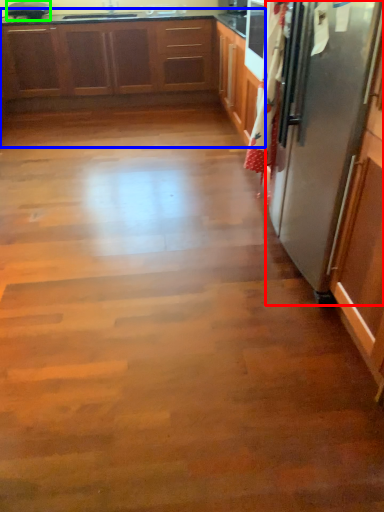
Question: Estimate the real-world distances between objects in this image. Which object is farther from refrigerator (highlighted by a red box), cabinetry (highlighted by a blue box) or appliance (highlighted by a green box)?

Choices:
 (A) cabinetry
 (B) appliance

Answer: (B)